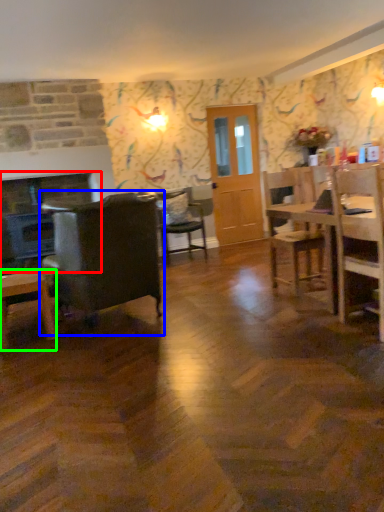
Question: Which object is positioned farthest from fireplace (highlighted by a red box)? Select from chair (highlighted by a blue box) and desk (highlighted by a green box).

Choices:
 (A) chair
 (B) desk

Answer: (A)